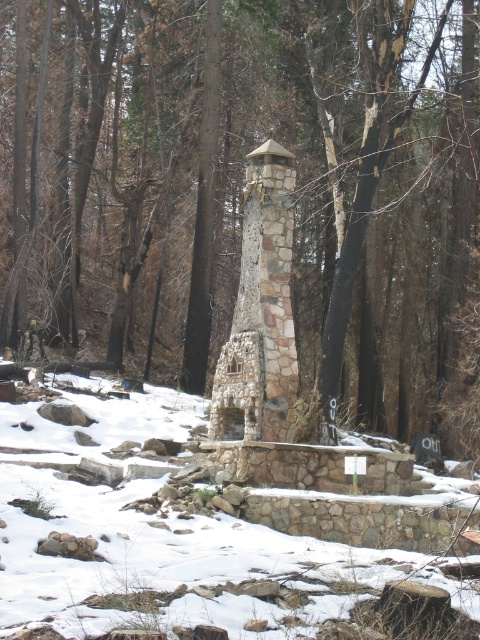
Question: Does smooth bark tree at center have a larger size compared to white powdery snow at center?

Choices:
 (A) yes
 (B) no

Answer: (A)

Question: Estimate the real-world distances between objects in this image. Which object is closer to the smooth bark tree at center?

Choices:
 (A) white powdery snow at center
 (B) stone textured chimney at center

Answer: (A)

Question: Which of these objects is positioned farthest from the white powdery snow at center?

Choices:
 (A) stone textured chimney at center
 (B) smooth bark tree at center

Answer: (B)

Question: Which object is positioned farthest from the white powdery snow at center?

Choices:
 (A) smooth bark tree at center
 (B) stone textured chimney at center

Answer: (A)

Question: Can you confirm if smooth bark tree at center is positioned below white powdery snow at center?

Choices:
 (A) yes
 (B) no

Answer: (B)

Question: Is smooth bark tree at center to the right of white powdery snow at center from the viewer's perspective?

Choices:
 (A) yes
 (B) no

Answer: (B)